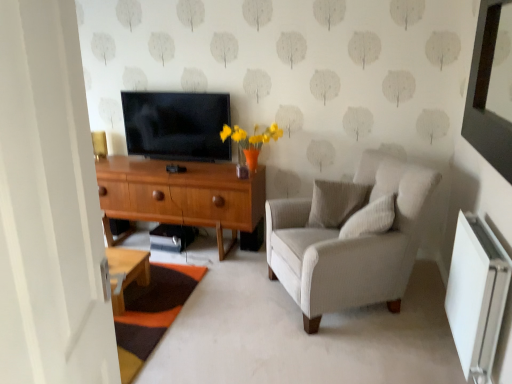
This screenshot has width=512, height=384. Identify the location of vacant space in front of wooden desk at center. (217, 315).